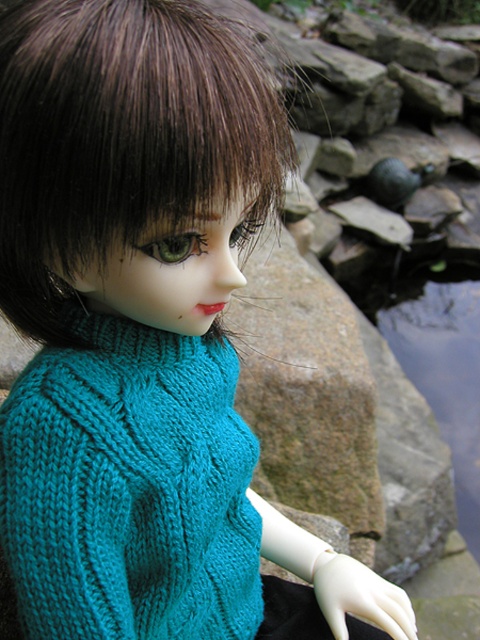
Can you confirm if teal knitted sweater at center is taller than brownhair at center?

Correct, teal knitted sweater at center is much taller as brownhair at center.

How distant is teal knitted sweater at center from brownhair at center?

They are 5.69 inches apart.

Is point (175, 368) farther from camera compared to point (66, 346)?

Yes, it is behind point (66, 346).

You are a GUI agent. You are given a task and a screenshot of the screen. Output one action in this format:
    pyautogui.click(x=<x>, y=<y>)
    Task: Click on the teal knitted sweater at center
    Image resolution: width=480 pixels, height=640 pixels.
    Given the screenshot: What is the action you would take?
    pyautogui.click(x=130, y=488)